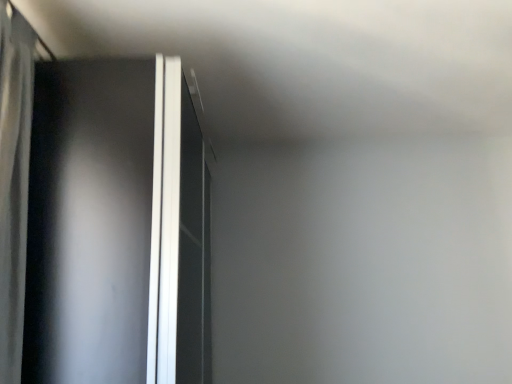
Find the location of `matte white screen door at left`. matte white screen door at left is located at coordinates (117, 227).

Describe the element at coordinates (117, 227) in the screenshot. This screenshot has height=384, width=512. I see `matte white screen door at left` at that location.

From the picture: In order to face matte white screen door at left, should I rotate leftwards or rightwards?

To face it directly, rotate left by 13.573 degrees.

Locate an element on the screen. The image size is (512, 384). matte white screen door at left is located at coordinates (117, 227).